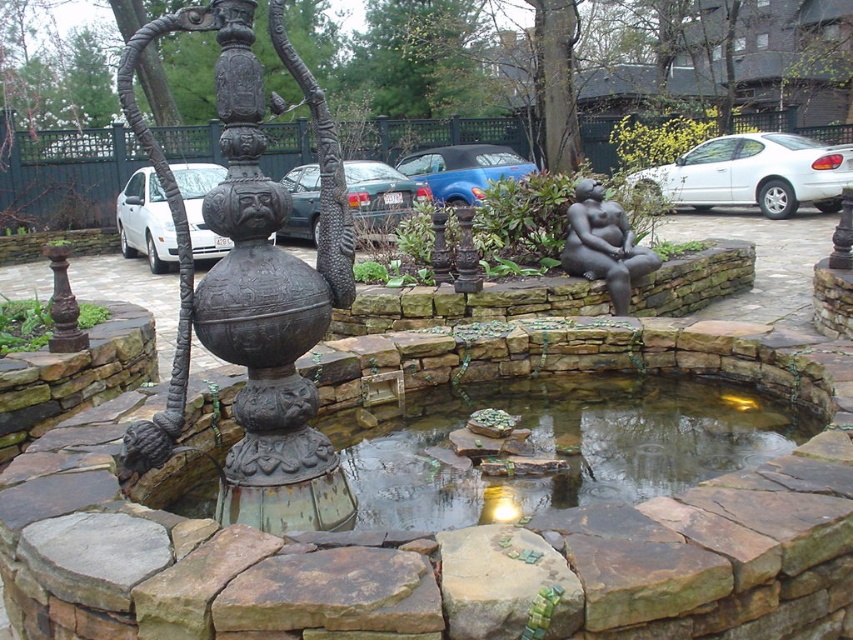
Consider the image. You are a photographer planning to take a photo of both the white glossy sedan at right and the white matte car at left. Since you want both cars to appear the same size in the photo, where should you position yourself relative to them?

To make both cars appear the same size in the photo, you should position yourself closer to the white matte car at left since it is smaller than the white glossy sedan at right. This way, the smaller car will appear larger in the frame, balancing their sizes.

You are planning to move the white glossy sedan at right closer to the rusty metal fountain at center. Based on their sizes, will there be enough space between them after moving the car?

The rusty metal fountain at center occupies less space than the white glossy sedan at right. Therefore, moving the white glossy sedan at right closer to the rusty metal fountain at center will still leave enough space between them since the car is larger and requires more room.

You are designing a garden layout and need to place a new decorative plant pot that is 1.2 meters wide. The pot must be placed next to the green stone pond at center without overlapping it. Considering the size of the matte bronze statue at center, is there enough space between the pond and the statue to place the pot?

The green stone pond at center is wider than the matte bronze statue at center. Since the pond is larger in width, there is sufficient space between them to place the 1.2 meters wide plant pot without overlapping the statue.